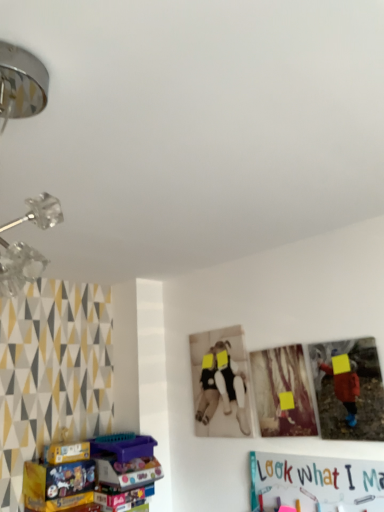
Where is `matte plastic picture frame at right, which is the 1th picture frame from right to left`? This screenshot has height=512, width=384. matte plastic picture frame at right, which is the 1th picture frame from right to left is located at coordinates (348, 389).

Measure the distance between matte plastic picture frame at right, which is the 1th picture frame from right to left, and camera.

matte plastic picture frame at right, which is the 1th picture frame from right to left, is 5.70 feet away from camera.

Measure the distance between wooden photo frame at center, which is counted as the second picture frame, starting from the right, and camera.

The distance of wooden photo frame at center, which is counted as the second picture frame, starting from the right, from camera is 6.37 feet.

What do you see at coordinates (283, 392) in the screenshot?
I see `wooden photo frame at center, the 1th picture frame in the left-to-right sequence` at bounding box center [283, 392].

What is the approximate height of matte cardboard box at lower left?

It is 13.36 inches.

Locate an element on the screen. The width and height of the screenshot is (384, 512). matte plastic picture frame at right, which is the 1th picture frame from right to left is located at coordinates (348, 389).

Can you confirm if matte cardboard box at lower left is smaller than metallic chrome lamp at upper left?

Indeed, matte cardboard box at lower left has a smaller size compared to metallic chrome lamp at upper left.

Which is closer to the camera, (126, 476) or (19, 95)?

Point (126, 476).

From a real-world perspective, is matte cardboard box at lower left on metallic chrome lamp at upper left?

Actually, matte cardboard box at lower left is physically below metallic chrome lamp at upper left in the real world.

Can you tell me how much matte cardboard box at lower left and metallic chrome lamp at upper left differ in facing direction?

There is a 90.3-degree angle between the facing directions of matte cardboard box at lower left and metallic chrome lamp at upper left.

Is wooden photo frame at center, which is counted as the second picture frame, starting from the right, placed right next to matte plastic picture frame at right, which is the 1th picture frame from right to left?

They are not placed beside each other.

Is wooden photo frame at center, the 1th picture frame in the left-to-right sequence, taller or shorter than matte plastic picture frame at right, which is the 2th picture frame in left-to-right order?

wooden photo frame at center, the 1th picture frame in the left-to-right sequence, is taller than matte plastic picture frame at right, which is the 2th picture frame in left-to-right order.

Measure the distance from wooden photo frame at center, the 1th picture frame in the left-to-right sequence, to matte plastic picture frame at right, which is the 1th picture frame from right to left.

A distance of 7.62 inches exists between wooden photo frame at center, the 1th picture frame in the left-to-right sequence, and matte plastic picture frame at right, which is the 1th picture frame from right to left.

From the picture: Can you confirm if wooden photo frame at center, which is counted as the second picture frame, starting from the right, is thinner than matte plastic picture frame at right, which is the 2th picture frame in left-to-right order?

Correct, the width of wooden photo frame at center, which is counted as the second picture frame, starting from the right, is less than that of matte plastic picture frame at right, which is the 2th picture frame in left-to-right order.

Is wooden photo frame at center, the 1th picture frame in the left-to-right sequence, located within matte cardboard box at lower left?

No, matte cardboard box at lower left does not contain wooden photo frame at center, the 1th picture frame in the left-to-right sequence.

Considering the sizes of matte cardboard box at lower left and wooden photo frame at center, the 1th picture frame in the left-to-right sequence, in the image, is matte cardboard box at lower left wider or thinner than wooden photo frame at center, the 1th picture frame in the left-to-right sequence,?

Considering their sizes, matte cardboard box at lower left looks broader than wooden photo frame at center, the 1th picture frame in the left-to-right sequence.

In the image, there is a wooden photo frame at center, which is counted as the second picture frame, starting from the right. What are the coordinates of `toy below it (from the image's perspective)` in the screenshot? It's located at (93, 475).

Is wooden photo frame at center, the 1th picture frame in the left-to-right sequence, a part of metallic chrome lamp at upper left?

Definitely not — wooden photo frame at center, the 1th picture frame in the left-to-right sequence, is not inside metallic chrome lamp at upper left.

Which object is further away from the camera taking this photo, metallic chrome lamp at upper left or wooden photo frame at center, the 1th picture frame in the left-to-right sequence?

wooden photo frame at center, the 1th picture frame in the left-to-right sequence, is further from the camera.

Is metallic chrome lamp at upper left far away from wooden photo frame at center, the 1th picture frame in the left-to-right sequence?

Indeed, metallic chrome lamp at upper left is not near wooden photo frame at center, the 1th picture frame in the left-to-right sequence.

Is metallic chrome lamp at upper left positioned with its back to wooden photo frame at center, the 1th picture frame in the left-to-right sequence?

Yes, metallic chrome lamp at upper left is facing away from wooden photo frame at center, the 1th picture frame in the left-to-right sequence.

How many degrees apart are the facing directions of matte plastic picture frame at right, which is the 1th picture frame from right to left, and matte cardboard box at lower left?

The angle between the facing direction of matte plastic picture frame at right, which is the 1th picture frame from right to left, and the facing direction of matte cardboard box at lower left is 88.5 degrees.

From the picture: Is matte plastic picture frame at right, which is the 1th picture frame from right to left, not inside matte cardboard box at lower left?

matte plastic picture frame at right, which is the 1th picture frame from right to left, lies outside matte cardboard box at lower left's area.

Considering the sizes of objects matte plastic picture frame at right, which is the 1th picture frame from right to left, and matte cardboard box at lower left in the image provided, who is smaller, matte plastic picture frame at right, which is the 1th picture frame from right to left, or matte cardboard box at lower left?

Smaller between the two is matte plastic picture frame at right, which is the 1th picture frame from right to left.

Between matte plastic picture frame at right, which is the 2th picture frame in left-to-right order, and matte cardboard box at lower left, which one has smaller width?

With smaller width is matte plastic picture frame at right, which is the 2th picture frame in left-to-right order.

Which object is thinner, matte cardboard box at lower left or matte plastic picture frame at right, which is the 2th picture frame in left-to-right order?

matte plastic picture frame at right, which is the 2th picture frame in left-to-right order, is thinner.

From a real-world perspective, which object rests below the other?

matte cardboard box at lower left.

Between matte cardboard box at lower left and matte plastic picture frame at right, which is the 2th picture frame in left-to-right order, which one has more height?

matte plastic picture frame at right, which is the 2th picture frame in left-to-right order, is taller.

How different are the orientations of wooden photo frame at center, the 1th picture frame in the left-to-right sequence, and metallic chrome lamp at upper left in degrees?

There is a 1.89-degree angle between the facing directions of wooden photo frame at center, the 1th picture frame in the left-to-right sequence, and metallic chrome lamp at upper left.

In the image, is wooden photo frame at center, the 1th picture frame in the left-to-right sequence, positioned in front of or behind metallic chrome lamp at upper left?

wooden photo frame at center, the 1th picture frame in the left-to-right sequence, is positioned farther from the viewer than metallic chrome lamp at upper left.

Is wooden photo frame at center, which is counted as the second picture frame, starting from the right, bigger or smaller than metallic chrome lamp at upper left?

Considering their sizes, wooden photo frame at center, which is counted as the second picture frame, starting from the right, takes up less space than metallic chrome lamp at upper left.

At what (x,y) coordinates should I click in order to perform the action: click on lamp in front of the matte cardboard box at lower left. Please return your answer as a coordinate pair (x, y). Looking at the image, I should click on (21, 83).

Find the location of a particular element. picture frame lying on the right of wooden photo frame at center, which is counted as the second picture frame, starting from the right is located at coordinates (348, 389).

When comparing their distances from matte plastic picture frame at right, which is the 2th picture frame in left-to-right order, does matte cardboard box at lower left or metallic chrome lamp at upper left seem closer?

Based on the image, matte cardboard box at lower left appears to be nearer to matte plastic picture frame at right, which is the 2th picture frame in left-to-right order.

Based on their spatial positions, is matte plastic picture frame at right, which is the 1th picture frame from right to left, or wooden photo frame at center, the 1th picture frame in the left-to-right sequence, further from matte cardboard box at lower left?

matte plastic picture frame at right, which is the 1th picture frame from right to left, is further to matte cardboard box at lower left.

Consider the image. Estimate the real-world distances between objects in this image. Which object is further from metallic chrome lamp at upper left, matte plastic picture frame at right, which is the 2th picture frame in left-to-right order, or matte cardboard box at lower left?

matte cardboard box at lower left is further to metallic chrome lamp at upper left.

Based on their spatial positions, is metallic chrome lamp at upper left or wooden photo frame at center, which is counted as the second picture frame, starting from the right, closer to matte plastic picture frame at right, which is the 1th picture frame from right to left?

Among the two, wooden photo frame at center, which is counted as the second picture frame, starting from the right, is located nearer to matte plastic picture frame at right, which is the 1th picture frame from right to left.

Considering their positions, is matte cardboard box at lower left positioned further to metallic chrome lamp at upper left than matte plastic picture frame at right, which is the 2th picture frame in left-to-right order?

matte cardboard box at lower left is positioned further to the anchor metallic chrome lamp at upper left.

Estimate the real-world distances between objects in this image. Which object is closer to matte cardboard box at lower left, matte plastic picture frame at right, which is the 2th picture frame in left-to-right order, or metallic chrome lamp at upper left?

matte plastic picture frame at right, which is the 2th picture frame in left-to-right order, is closer to matte cardboard box at lower left.

When comparing their distances from matte plastic picture frame at right, which is the 1th picture frame from right to left, does matte cardboard box at lower left or wooden photo frame at center, which is counted as the second picture frame, starting from the right, seem closer?

wooden photo frame at center, which is counted as the second picture frame, starting from the right, is positioned closer to the anchor matte plastic picture frame at right, which is the 1th picture frame from right to left.

Which object lies nearer to the anchor point metallic chrome lamp at upper left, matte plastic picture frame at right, which is the 1th picture frame from right to left, or wooden photo frame at center, the 1th picture frame in the left-to-right sequence?

matte plastic picture frame at right, which is the 1th picture frame from right to left.

Find the location of a particular element. picture frame between metallic chrome lamp at upper left and wooden photo frame at center, which is counted as the second picture frame, starting from the right, along the z-axis is located at coordinates (348, 389).

The image size is (384, 512). Find the location of `picture frame located between matte cardboard box at lower left and matte plastic picture frame at right, which is the 1th picture frame from right to left, in the left-right direction`. picture frame located between matte cardboard box at lower left and matte plastic picture frame at right, which is the 1th picture frame from right to left, in the left-right direction is located at coordinates pos(283,392).